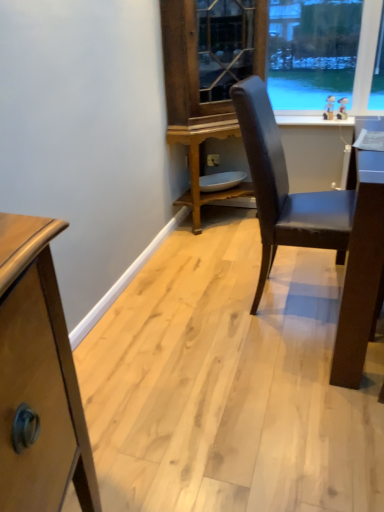
Question: Considering the relative sizes of wooden cabinet at center and white plastic power outlet at center in the image provided, is wooden cabinet at center wider than white plastic power outlet at center?

Choices:
 (A) no
 (B) yes

Answer: (B)

Question: Considering the relative positions of wooden cabinet at center and white plastic power outlet at center in the image provided, is wooden cabinet at center in front of white plastic power outlet at center?

Choices:
 (A) yes
 (B) no

Answer: (A)

Question: Can you confirm if wooden cabinet at center is taller than white plastic power outlet at center?

Choices:
 (A) yes
 (B) no

Answer: (A)

Question: Can you confirm if wooden cabinet at center is bigger than white plastic power outlet at center?

Choices:
 (A) no
 (B) yes

Answer: (B)

Question: From a real-world perspective, is wooden cabinet at center on white plastic power outlet at center?

Choices:
 (A) yes
 (B) no

Answer: (A)

Question: Is white glossy window sill at upper right inside or outside of matte black chair at center?

Choices:
 (A) inside
 (B) outside

Answer: (B)

Question: From the image's perspective, is white glossy window sill at upper right above or below matte black chair at center?

Choices:
 (A) above
 (B) below

Answer: (A)

Question: In terms of height, does white glossy window sill at upper right look taller or shorter compared to matte black chair at center?

Choices:
 (A) short
 (B) tall

Answer: (A)

Question: Based on their sizes in the image, would you say white glossy window sill at upper right is bigger or smaller than matte black chair at center?

Choices:
 (A) big
 (B) small

Answer: (B)

Question: In the image, is wooden cabinet at center on the left side or the right side of matte black chair at center?

Choices:
 (A) right
 (B) left

Answer: (B)

Question: Is point (337, 65) closer or farther from the camera than point (312, 212)?

Choices:
 (A) farther
 (B) closer

Answer: (A)

Question: From the image's perspective, is wooden cabinet at center above or below matte black chair at center?

Choices:
 (A) above
 (B) below

Answer: (A)

Question: Is wooden cabinet at center bigger or smaller than matte black chair at center?

Choices:
 (A) big
 (B) small

Answer: (A)

Question: Is white plastic power outlet at center wider or thinner than wooden cabinet at center?

Choices:
 (A) thin
 (B) wide

Answer: (A)

Question: Relative to wooden cabinet at center, is white plastic power outlet at center in front or behind?

Choices:
 (A) behind
 (B) front

Answer: (A)